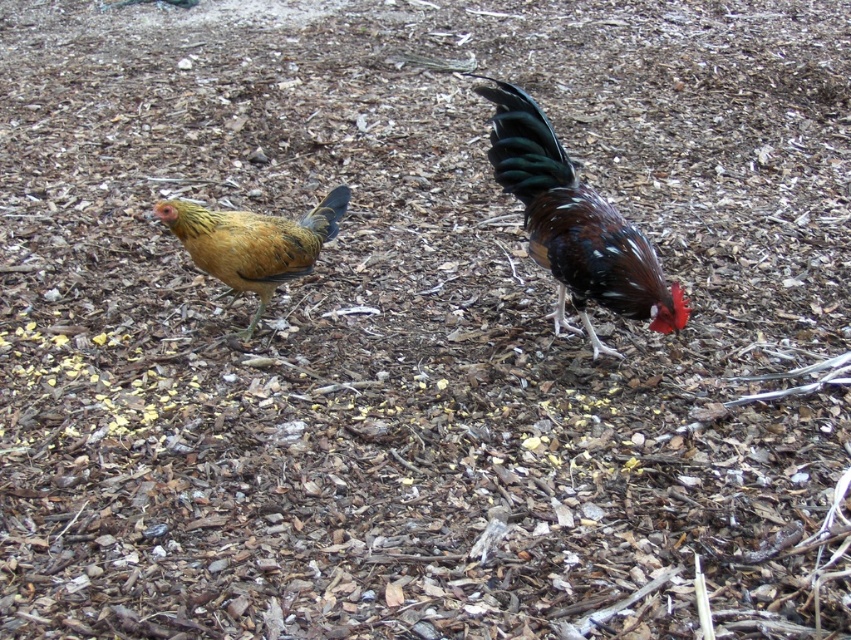
You are a photographer trying to capture a closeup of the shiny brown rooster at right. Given that your camera can focus on subjects within 2 meters, will you be able to take the closeup without moving closer?

The shiny brown rooster at right is 2.49 meters away from camera, so it is slightly out of the camera focus range of 2 meters. You need to move closer to get within 2 meters to take the closeup.